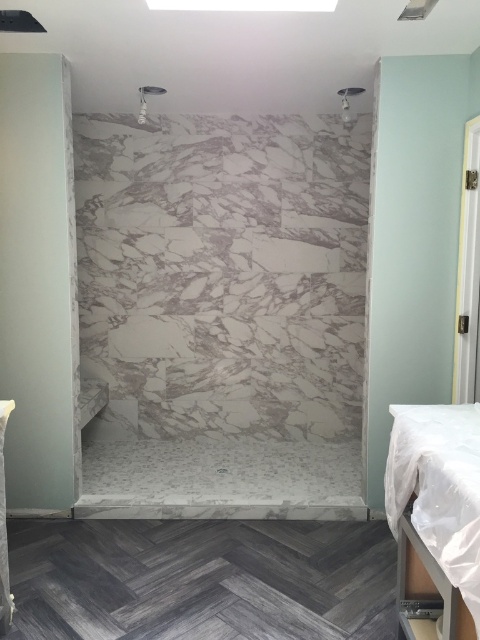
Does matte white showerhead at upper center appear on the right side of white marble shower at upper center?

Incorrect, matte white showerhead at upper center is not on the right side of white marble shower at upper center.

Does point (153, 93) come behind point (345, 109)?

Yes, it is.

Between point (140, 93) and point (349, 92), which one is positioned behind?

The point (140, 93) is behind.

This screenshot has width=480, height=640. I want to click on matte white showerhead at upper center, so click(145, 100).

Does white fabric bed at lower right have a larger size compared to matte white showerhead at upper center?

Indeed, white fabric bed at lower right has a larger size compared to matte white showerhead at upper center.

Based on the photo, can you confirm if white fabric bed at lower right is smaller than matte white showerhead at upper center?

Actually, white fabric bed at lower right might be larger than matte white showerhead at upper center.

Which is behind, point (386, 509) or point (154, 88)?

The point (154, 88) is behind.

The width and height of the screenshot is (480, 640). Identify the location of white fabric bed at lower right. (439, 486).

Does white fabric bed at lower right have a larger size compared to white marble shower at upper center?

Yes, white fabric bed at lower right is bigger than white marble shower at upper center.

In the scene shown: Which of these two, white fabric bed at lower right or white marble shower at upper center, stands taller?

With more height is white fabric bed at lower right.

Where is `white fabric bed at lower right`? white fabric bed at lower right is located at coordinates (439, 486).

At what (x,y) coordinates should I click in order to perform the action: click on white fabric bed at lower right. Please return your answer as a coordinate pair (x, y). The width and height of the screenshot is (480, 640). Looking at the image, I should click on [x=439, y=486].